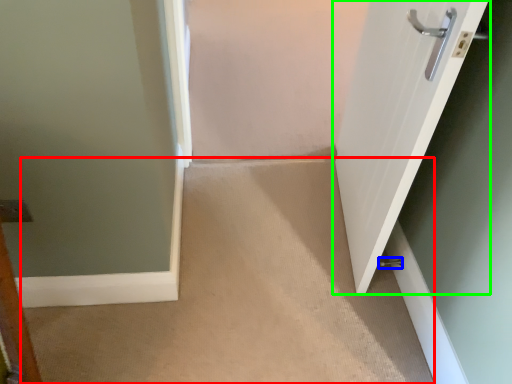
Question: Considering the real-world distances, which object is farthest from corridor (highlighted by a red box)? door handle (highlighted by a blue box) or door (highlighted by a green box)?

Choices:
 (A) door handle
 (B) door

Answer: (A)